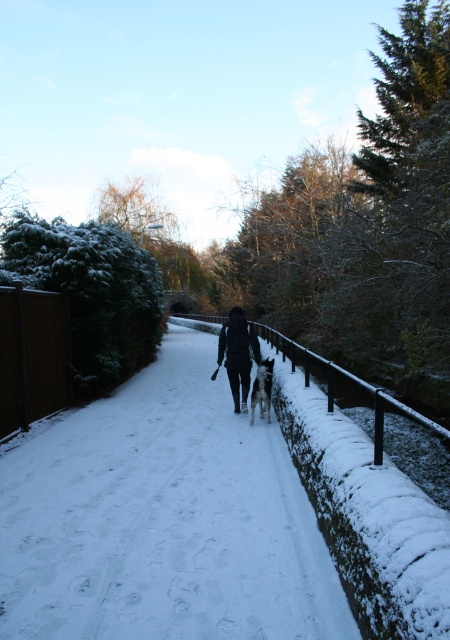
Question: Which point appears closest to the camera in this image?

Choices:
 (A) (260, 374)
 (B) (237, 364)

Answer: (A)

Question: In this image, where is white snow at center located relative to black matte jacket at center?

Choices:
 (A) above
 (B) below

Answer: (B)

Question: Which point is farther from the camera taking this photo?

Choices:
 (A) (247, 387)
 (B) (160, 513)
 (C) (257, 365)

Answer: (A)

Question: Considering the real-world distances, which object is closest to the white fur dog at center?

Choices:
 (A) white snow at center
 (B) black matte jacket at center

Answer: (B)

Question: Is black matte jacket at center above white fur dog at center?

Choices:
 (A) yes
 (B) no

Answer: (A)

Question: Does black matte jacket at center appear under white fur dog at center?

Choices:
 (A) no
 (B) yes

Answer: (A)